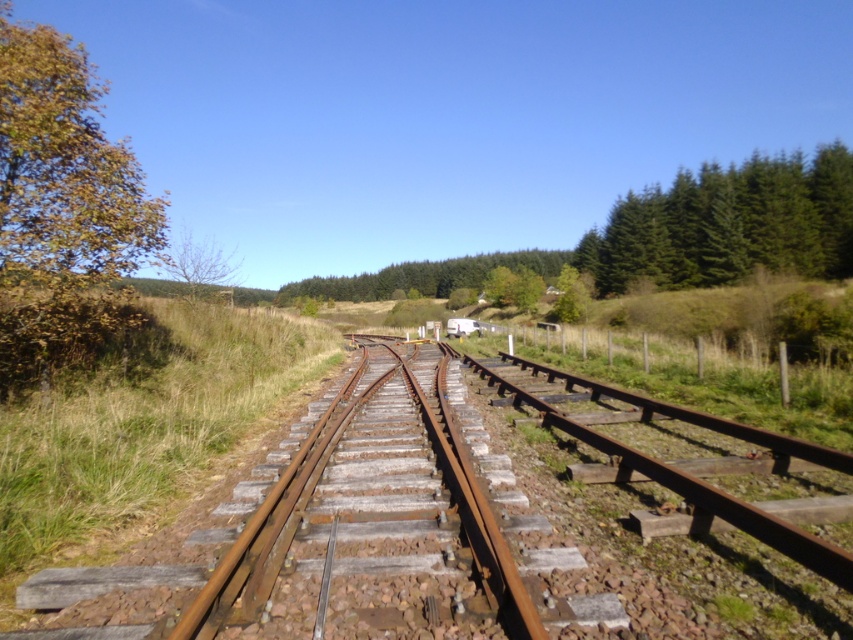
Question: Considering the real-world distances, which object is closest to the green coniferous trees at upper right?

Choices:
 (A) yellow-green leaves at left
 (B) rusty metal train track at center
 (C) bare branches at left

Answer: (B)

Question: Which object appears farthest from the camera in this image?

Choices:
 (A) rusty metal train track at center
 (B) green coniferous trees at upper right
 (C) bare branches at left

Answer: (B)

Question: Does rusty metal train track at center appear on the left side of bare branches at left?

Choices:
 (A) yes
 (B) no

Answer: (B)

Question: Is yellow-green leaves at left above green coniferous trees at upper right?

Choices:
 (A) no
 (B) yes

Answer: (A)

Question: Based on their relative distances, which object is nearer to the bare branches at left?

Choices:
 (A) yellow-green leaves at left
 (B) rusty metal train track at center

Answer: (B)

Question: Does yellow-green leaves at left have a lesser width compared to bare branches at left?

Choices:
 (A) yes
 (B) no

Answer: (A)